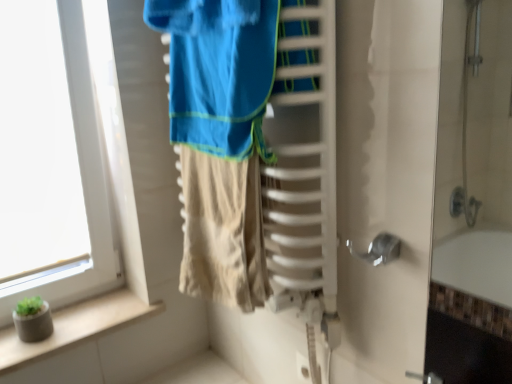
Describe the element at coordinates (76, 327) in the screenshot. I see `green concrete planter at lower left` at that location.

What is the approximate width of white plastic electric outlet at lower center?

white plastic electric outlet at lower center is 0.54 inches wide.

This screenshot has height=384, width=512. I want to click on green concrete planter at lower left, so 76,327.

In the scene shown: Is white glass window at left with white plastic electric outlet at lower center?

No, white glass window at left is not in contact with white plastic electric outlet at lower center.

Is white glass window at left inside the boundaries of white plastic electric outlet at lower center, or outside?

white glass window at left is located beyond the bounds of white plastic electric outlet at lower center.

Identify the location of window above the white plastic electric outlet at lower center (from the image's perspective). (82, 177).

Who is bigger, white glass window at left or white plastic electric outlet at lower center?

Bigger between the two is white glass window at left.

Is green concrete planter at lower left to the right of white plastic electric outlet at lower center from the viewer's perspective?

No, green concrete planter at lower left is not to the right of white plastic electric outlet at lower center.

Are green concrete planter at lower left and white plastic electric outlet at lower center far apart?

No, there isn't a large distance between green concrete planter at lower left and white plastic electric outlet at lower center.

Considering the relative positions of green concrete planter at lower left and white plastic electric outlet at lower center in the image provided, is green concrete planter at lower left in front of white plastic electric outlet at lower center?

No, green concrete planter at lower left is further to the viewer.

Between white glass window at left and green concrete planter at lower left, which one has less height?

With less height is green concrete planter at lower left.

Considering the sizes of white glass window at left and green concrete planter at lower left in the image, is white glass window at left wider or thinner than green concrete planter at lower left?

In the image, white glass window at left appears to be more narrow than green concrete planter at lower left.

Is white glass window at left further to camera compared to green concrete planter at lower left?

That is False.

Is white plastic electric outlet at lower center to the left of green concrete planter at lower left from the viewer's perspective?

Incorrect, white plastic electric outlet at lower center is not on the left side of green concrete planter at lower left.

From the image's perspective, is white plastic electric outlet at lower center located beneath green concrete planter at lower left?

Yes, from the image's perspective, white plastic electric outlet at lower center is below green concrete planter at lower left.

This screenshot has width=512, height=384. What are the coordinates of `balustrade above the white plastic electric outlet at lower center (from a real-world perspective)` in the screenshot? It's located at (76, 327).

From a real-world perspective, who is located lower, white plastic electric outlet at lower center or green concrete planter at lower left?

From a 3D spatial view, white plastic electric outlet at lower center is below.

In terms of width, does white plastic electric outlet at lower center look wider or thinner when compared to white glass window at left?

In the image, white plastic electric outlet at lower center appears to be more narrow than white glass window at left.

Can you confirm if white plastic electric outlet at lower center is taller than white glass window at left?

No, white plastic electric outlet at lower center is not taller than white glass window at left.

From a real-world perspective, is white plastic electric outlet at lower center located beneath white glass window at left?

Yes, from a real-world perspective, white plastic electric outlet at lower center is under white glass window at left.

Which is behind, point (309, 374) or point (40, 292)?

The point (40, 292) is farther.

From the image's perspective, who appears lower, green concrete planter at lower left or white glass window at left?

green concrete planter at lower left, from the image's perspective.

How different are the orientations of green concrete planter at lower left and white glass window at left in degrees?

0.00731 degrees.

Visually, is green concrete planter at lower left positioned to the left or to the right of white glass window at left?

Based on their positions, green concrete planter at lower left is located to the right of white glass window at left.

Could you tell me if green concrete planter at lower left is facing white glass window at left?

No, green concrete planter at lower left is not facing towards white glass window at left.

Identify the location of window on the left of white plastic electric outlet at lower center. (82, 177).

You are a GUI agent. You are given a task and a screenshot of the screen. Output one action in this format:
    pyautogui.click(x=<x>, y=<y>)
    Task: Click on the electric outlet on the right of green concrete planter at lower left
    
    Given the screenshot: What is the action you would take?
    pyautogui.click(x=303, y=368)

Estimate the real-world distances between objects in this image. Which object is closer to white plastic electric outlet at lower center, green concrete planter at lower left or white glass window at left?

Based on the image, green concrete planter at lower left appears to be nearer to white plastic electric outlet at lower center.

Estimate the real-world distances between objects in this image. Which object is closer to green concrete planter at lower left, white plastic electric outlet at lower center or white glass window at left?

Among the two, white glass window at left is located nearer to green concrete planter at lower left.

When comparing their distances from white plastic electric outlet at lower center, does white glass window at left or green concrete planter at lower left seem further?

Based on the image, white glass window at left appears to be further to white plastic electric outlet at lower center.

Which object lies nearer to the anchor point white glass window at left, green concrete planter at lower left or white plastic electric outlet at lower center?

Among the two, green concrete planter at lower left is located nearer to white glass window at left.

Looking at the image, which one is located closer to green concrete planter at lower left, white glass window at left or white plastic electric outlet at lower center?

The object closer to green concrete planter at lower left is white glass window at left.

Based on their spatial positions, is white plastic electric outlet at lower center or green concrete planter at lower left further from white glass window at left?

Among the two, white plastic electric outlet at lower center is located further to white glass window at left.

The width and height of the screenshot is (512, 384). In order to click on balustrade between white glass window at left and white plastic electric outlet at lower center in this screenshot , I will do `click(76, 327)`.